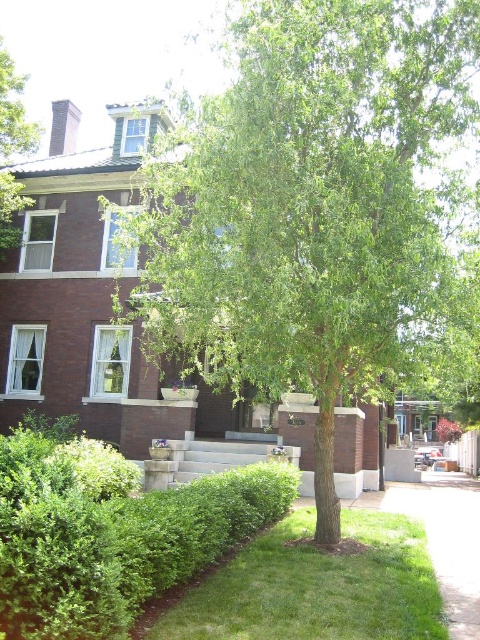
Question: Which of the following is the farthest from the observer?

Choices:
 (A) green grass at lower center
 (B) green leafy tree at center
 (C) green grass at lower right
 (D) green leafy hedge at lower left

Answer: (B)

Question: Which point is farther to the camera?

Choices:
 (A) green grass at lower right
 (B) green leafy tree at upper left

Answer: (B)

Question: Is green leafy tree at center thinner than green grass at lower center?

Choices:
 (A) yes
 (B) no

Answer: (A)

Question: Is green grass at lower right above green leafy tree at upper left?

Choices:
 (A) yes
 (B) no

Answer: (B)

Question: Estimate the real-world distances between objects in this image. Which object is closer to the green leafy tree at upper left?

Choices:
 (A) green grass at lower right
 (B) green leafy tree at center

Answer: (A)

Question: Can you confirm if green leafy hedge at lower left is smaller than green grass at lower center?

Choices:
 (A) yes
 (B) no

Answer: (A)